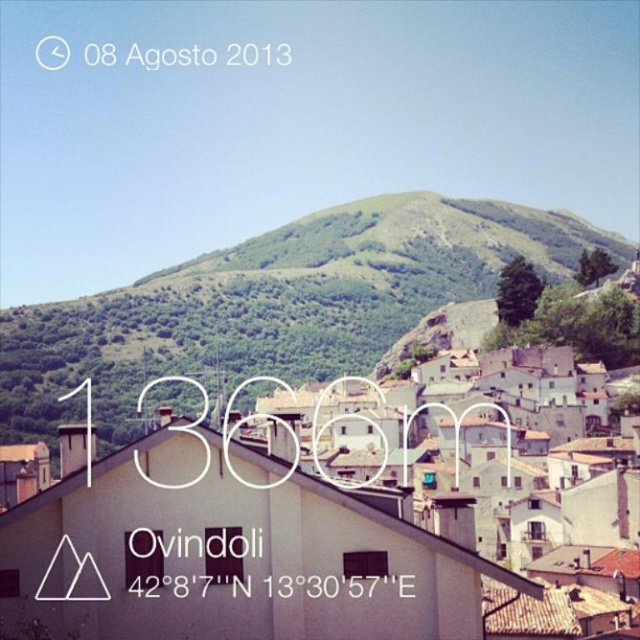
Can you confirm if white matte building at center is taller than green grassy hill at upper center?

No, white matte building at center is not taller than green grassy hill at upper center.

Is white matte building at center positioned before green grassy hill at upper center?

That is True.

Locate an element on the screen. Image resolution: width=640 pixels, height=640 pixels. white matte building at center is located at coordinates (301, 541).